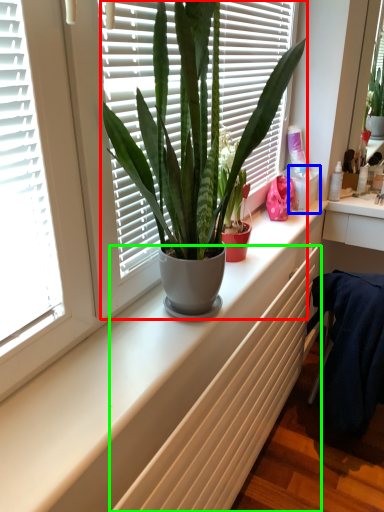
Question: Which object is positioned farthest from houseplant (highlighted by a red box)? Select from window box (highlighted by a blue box) and radiator (highlighted by a green box).

Choices:
 (A) window box
 (B) radiator

Answer: (A)